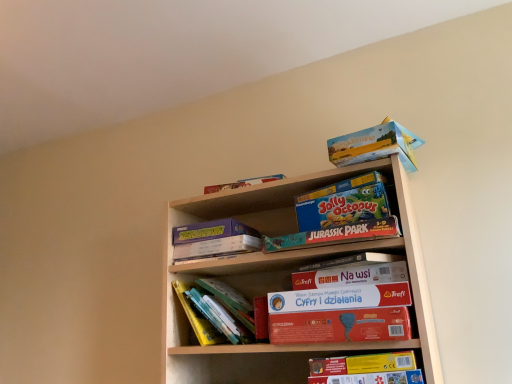
What is the approximate width of red matte board game at center, acting as the 1th paperback book starting from the bottom?

red matte board game at center, acting as the 1th paperback book starting from the bottom, is 9.26 inches in width.

Measure the distance between point (208, 299) and camera.

Point (208, 299) and camera are 4.66 feet apart from each other.

Measure the distance between matte cardboard box at upper right and camera.

matte cardboard box at upper right and camera are 3.74 feet apart.

The image size is (512, 384). I want to click on blue cardboard jolly octopus board game at center, which appears as the 5th paperback book when ordered from the bottom, so click(343, 203).

Where is `white matte paperback book at center, placed as the 2th paperback book when sorted from bottom to top`? white matte paperback book at center, placed as the 2th paperback book when sorted from bottom to top is located at coordinates (340, 298).

Describe the element at coordinates (340, 298) in the screenshot. Image resolution: width=512 pixels, height=384 pixels. I see `white matte paperback book at center, which is counted as the 4th paperback book, starting from the top` at that location.

Where is `matte purple book at upper center, marked as the 3th paperback book in a bottom-to-top arrangement`? The width and height of the screenshot is (512, 384). matte purple book at upper center, marked as the 3th paperback book in a bottom-to-top arrangement is located at coordinates (214, 239).

Identify the location of yellow cardboard book at lower right, placed as the first book when sorted from right to left. (366, 369).

The width and height of the screenshot is (512, 384). Identify the location of red matte board game at center, which is counted as the 5th paperback book, starting from the top. (340, 326).

Is red matte board game at center, acting as the 1th paperback book starting from the bottom, placed right next to hardcover books at center, which is the first book from left to right?

No, red matte board game at center, acting as the 1th paperback book starting from the bottom, is not next to hardcover books at center, which is the first book from left to right.

Can you tell me how much red matte board game at center, which is counted as the 5th paperback book, starting from the top, and hardcover books at center, the first book positioned from the back, differ in facing direction?

The angular difference between red matte board game at center, which is counted as the 5th paperback book, starting from the top, and hardcover books at center, the first book positioned from the back, is 1.23 degrees.

From a real-world perspective, which is physically below, red matte board game at center, acting as the 1th paperback book starting from the bottom, or hardcover books at center, the first book positioned from the back?

red matte board game at center, acting as the 1th paperback book starting from the bottom, from a real-world perspective.

Considering the sizes of objects red matte board game at center, which is counted as the 5th paperback book, starting from the top, and matte purple book at upper center, marked as the 3th paperback book in a bottom-to-top arrangement, in the image provided, who is taller, red matte board game at center, which is counted as the 5th paperback book, starting from the top, or matte purple book at upper center, marked as the 3th paperback book in a bottom-to-top arrangement,?

red matte board game at center, which is counted as the 5th paperback book, starting from the top, is taller.

Which of these two, red matte board game at center, which is counted as the 5th paperback book, starting from the top, or matte purple book at upper center, positioned as the 3th paperback book in top-to-bottom order, is bigger?

Bigger between the two is red matte board game at center, which is counted as the 5th paperback book, starting from the top.

Considering the points (325, 313) and (252, 228), which point is in front, point (325, 313) or point (252, 228)?

Positioned in front is point (325, 313).

From a real-world perspective, which is physically above, red matte board game at center, which is counted as the 5th paperback book, starting from the top, or matte purple book at upper center, marked as the 3th paperback book in a bottom-to-top arrangement?

From a 3D spatial view, matte purple book at upper center, marked as the 3th paperback book in a bottom-to-top arrangement, is above.

Can you confirm if blue cardboard jolly octopus board game at center, which appears as the 5th paperback book when ordered from the bottom, is shorter than red matte board game at center, acting as the 1th paperback book starting from the bottom?

Incorrect, the height of blue cardboard jolly octopus board game at center, which appears as the 5th paperback book when ordered from the bottom, does not fall short of that of red matte board game at center, acting as the 1th paperback book starting from the bottom.

Is red matte board game at center, which is counted as the 5th paperback book, starting from the top, at the back of blue cardboard jolly octopus board game at center, which appears as the 5th paperback book when ordered from the bottom?

blue cardboard jolly octopus board game at center, which appears as the 5th paperback book when ordered from the bottom, does not have its back to red matte board game at center, which is counted as the 5th paperback book, starting from the top.

What's the angular difference between blue cardboard jolly octopus board game at center, which appears as the 5th paperback book when ordered from the bottom, and red matte board game at center, which is counted as the 5th paperback book, starting from the top,'s facing directions?

The angular difference between blue cardboard jolly octopus board game at center, which appears as the 5th paperback book when ordered from the bottom, and red matte board game at center, which is counted as the 5th paperback book, starting from the top, is 2.53 degrees.

How far apart are blue cardboard jolly octopus board game at center, which appears as the 5th paperback book when ordered from the bottom, and red matte board game at center, acting as the 1th paperback book starting from the bottom?

The distance of blue cardboard jolly octopus board game at center, which appears as the 5th paperback book when ordered from the bottom, from red matte board game at center, acting as the 1th paperback book starting from the bottom, is 11.38 inches.

The height and width of the screenshot is (384, 512). Identify the location of book behind the matte cardboard box at upper right. (210, 317).

Is matte cardboard box at upper right beside hardcover books at center, placed as the 2th book when sorted from right to left?

There is a gap between matte cardboard box at upper right and hardcover books at center, placed as the 2th book when sorted from right to left.

Would you say matte cardboard box at upper right is inside or outside hardcover books at center, which is the first book from left to right?

matte cardboard box at upper right is located beyond the bounds of hardcover books at center, which is the first book from left to right.

From the image's perspective, relative to hardcover books at center, acting as the 2th book starting from the front, is matte cardboard box at upper right above or below?

matte cardboard box at upper right is situated higher than hardcover books at center, acting as the 2th book starting from the front, in the image.

Based on the photo, from the image's perspective, is white matte paperback book at center, placed as the 2th paperback book when sorted from bottom to top, on top of blue cardboard jolly octopus board game at center, the first paperback book in the top-to-bottom sequence?

No, from the image's perspective, white matte paperback book at center, placed as the 2th paperback book when sorted from bottom to top, is not above blue cardboard jolly octopus board game at center, the first paperback book in the top-to-bottom sequence.

From the image's perspective, count 3rd paperback books downward from the blue cardboard jolly octopus board game at center, which appears as the 5th paperback book when ordered from the bottom, and point to it. Please provide its 2D coordinates.

[(340, 298)]

Is the depth of white matte paperback book at center, placed as the 2th paperback book when sorted from bottom to top, greater than that of blue cardboard jolly octopus board game at center, which appears as the 5th paperback book when ordered from the bottom?

No, white matte paperback book at center, placed as the 2th paperback book when sorted from bottom to top, is closer to the camera.

Based on the photo, which of these two, white matte paperback book at center, which is counted as the 4th paperback book, starting from the top, or blue cardboard jolly octopus board game at center, the first paperback book in the top-to-bottom sequence, is bigger?

Bigger between the two is white matte paperback book at center, which is counted as the 4th paperback book, starting from the top.

From a real-world perspective, which object rests below the other?

In real-world perspective, blue cardboard jolly octopus board game at center, which appears as the 5th paperback book when ordered from the bottom, is lower.

Based on their positions, is blue cardboard jolly octopus board game at center, the first paperback book in the top-to-bottom sequence, located to the left or right of matte cardboard box at upper right?

Based on their positions, blue cardboard jolly octopus board game at center, the first paperback book in the top-to-bottom sequence, is located to the left of matte cardboard box at upper right.

Does blue cardboard jolly octopus board game at center, which appears as the 5th paperback book when ordered from the bottom, have a greater height compared to matte cardboard box at upper right?

Yes, blue cardboard jolly octopus board game at center, which appears as the 5th paperback book when ordered from the bottom, is taller than matte cardboard box at upper right.

Who is bigger, teal matte jurassic park puzzle at center, which ranks as the fourth paperback book in bottom-to-top order, or hardcover books at center, acting as the 2th book starting from the front?

With larger size is hardcover books at center, acting as the 2th book starting from the front.

Which of these two, teal matte jurassic park puzzle at center, the second paperback book in the top-to-bottom sequence, or hardcover books at center, acting as the 2th book starting from the front, stands shorter?

teal matte jurassic park puzzle at center, the second paperback book in the top-to-bottom sequence, is shorter.

The width and height of the screenshot is (512, 384). Find the location of `the 2nd paperback book in front of the hardcover books at center, the first book positioned from the back`. the 2nd paperback book in front of the hardcover books at center, the first book positioned from the back is located at coordinates [x=335, y=235].

Could hardcover books at center, which is the first book from left to right, be considered to be inside teal matte jurassic park puzzle at center, the second paperback book in the top-to-bottom sequence?

Actually, hardcover books at center, which is the first book from left to right, is outside teal matte jurassic park puzzle at center, the second paperback book in the top-to-bottom sequence.

Find the location of a particular element. This screenshot has height=384, width=512. paperback book that appears below the hardcover books at center, the first book positioned from the back (from a real-world perspective) is located at coordinates (340, 326).

Locate an element on the screen. The image size is (512, 384). the 3rd paperback book above the red matte board game at center, acting as the 1th paperback book starting from the bottom (from a real-world perspective) is located at coordinates (214, 239).

Estimate the real-world distances between objects in this image. Which object is closer to hardcover books at center, placed as the 2th book when sorted from right to left, yellow cardboard book at lower right, placed as the first book when sorted from right to left, or white matte paperback book at center, which is counted as the 4th paperback book, starting from the top?

white matte paperback book at center, which is counted as the 4th paperback book, starting from the top, is positioned closer to the anchor hardcover books at center, placed as the 2th book when sorted from right to left.

From the image, which object appears to be nearer to yellow cardboard book at lower right, acting as the first book starting from the front, blue cardboard jolly octopus board game at center, the first paperback book in the top-to-bottom sequence, or red matte board game at center, acting as the 1th paperback book starting from the bottom?

Among the two, red matte board game at center, acting as the 1th paperback book starting from the bottom, is located nearer to yellow cardboard book at lower right, acting as the first book starting from the front.

When comparing their distances from red matte board game at center, which is counted as the 5th paperback book, starting from the top, does teal matte jurassic park puzzle at center, which ranks as the fourth paperback book in bottom-to-top order, or hardcover books at center, the first book positioned from the back, seem closer?

teal matte jurassic park puzzle at center, which ranks as the fourth paperback book in bottom-to-top order, is closer to red matte board game at center, which is counted as the 5th paperback book, starting from the top.

Looking at this image, estimate the real-world distances between objects in this image. Which object is closer to red matte board game at center, acting as the 1th paperback book starting from the bottom, matte purple book at upper center, marked as the 3th paperback book in a bottom-to-top arrangement, or white matte paperback book at center, placed as the 2th paperback book when sorted from bottom to top?

white matte paperback book at center, placed as the 2th paperback book when sorted from bottom to top, is positioned closer to the anchor red matte board game at center, acting as the 1th paperback book starting from the bottom.

From the image, which object appears to be farther from hardcover books at center, placed as the 2th book when sorted from right to left, matte cardboard box at upper right or white matte paperback book at center, which is counted as the 4th paperback book, starting from the top?

matte cardboard box at upper right.

From the image, which object appears to be nearer to teal matte jurassic park puzzle at center, the second paperback book in the top-to-bottom sequence, red matte board game at center, which is counted as the 5th paperback book, starting from the top, or blue cardboard jolly octopus board game at center, which appears as the 5th paperback book when ordered from the bottom?

blue cardboard jolly octopus board game at center, which appears as the 5th paperback book when ordered from the bottom.

From the image, which object appears to be farther from matte purple book at upper center, positioned as the 3th paperback book in top-to-bottom order, white matte paperback book at center, which is counted as the 4th paperback book, starting from the top, or hardcover books at center, placed as the 2th book when sorted from right to left?

white matte paperback book at center, which is counted as the 4th paperback book, starting from the top.

When comparing their distances from matte cardboard box at upper right, does teal matte jurassic park puzzle at center, the second paperback book in the top-to-bottom sequence, or hardcover books at center, which is the first book from left to right, seem further?

hardcover books at center, which is the first book from left to right.

Find the location of `book between matte cardboard box at upper right and yellow cardboard book at lower right, marked as the second book in a back-to-front arrangement, from top to bottom`. book between matte cardboard box at upper right and yellow cardboard book at lower right, marked as the second book in a back-to-front arrangement, from top to bottom is located at coordinates (210, 317).

Identify the location of paperback book between matte cardboard box at upper right and teal matte jurassic park puzzle at center, the second paperback book in the top-to-bottom sequence, vertically. (343, 203).

Identify the location of book between matte purple book at upper center, positioned as the 3th paperback book in top-to-bottom order, and red matte board game at center, which is counted as the 5th paperback book, starting from the top, from left to right. (210, 317).

In order to click on paperback book between hardcover books at center, acting as the 2th book starting from the front, and white matte paperback book at center, placed as the 2th paperback book when sorted from bottom to top, in the horizontal direction in this screenshot , I will do `click(335, 235)`.